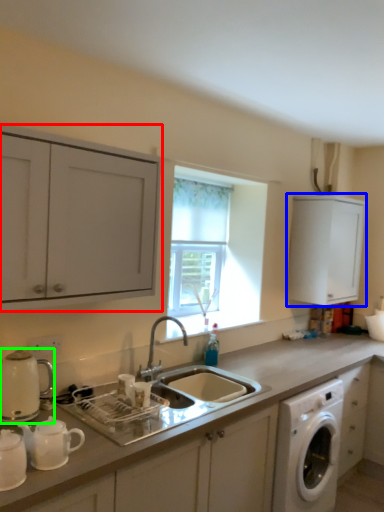
Question: Which object is positioned closest to cabinetry (highlighted by a red box)? Select from cabinetry (highlighted by a blue box) and appliance (highlighted by a green box).

Choices:
 (A) cabinetry
 (B) appliance

Answer: (B)